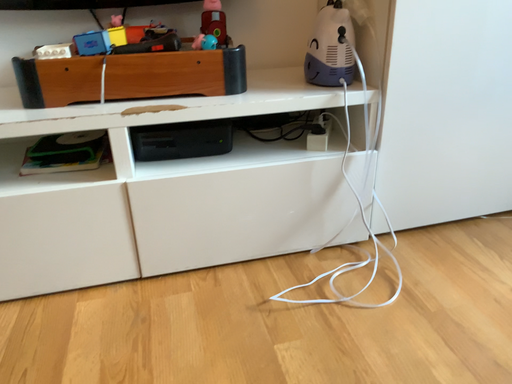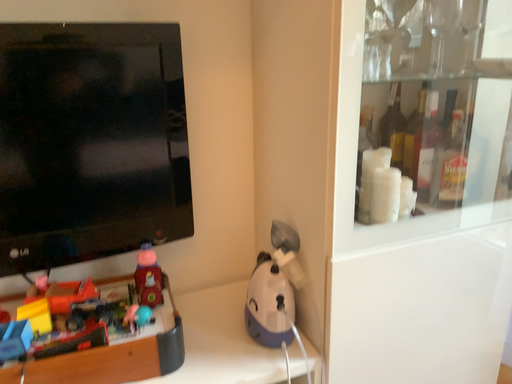
Question: How did the camera likely rotate when shooting the video?

Choices:
 (A) rotated left
 (B) rotated right

Answer: (B)